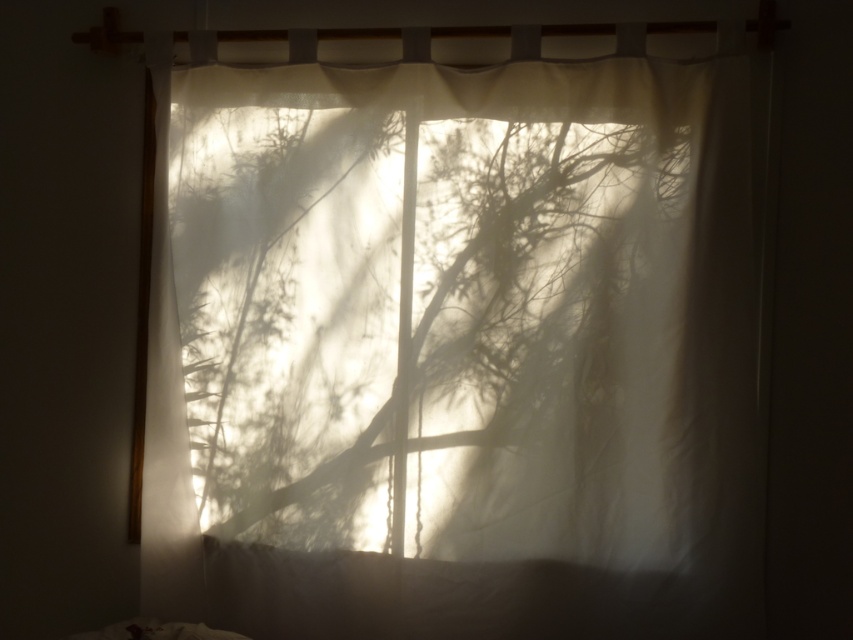
Question: Is translucent white curtain at center to the left of white soft pillow at lower center from the viewer's perspective?

Choices:
 (A) yes
 (B) no

Answer: (A)

Question: Does translucent white curtain at center appear over white soft pillow at lower center?

Choices:
 (A) yes
 (B) no

Answer: (A)

Question: Does translucent white curtain at center appear over white soft pillow at lower center?

Choices:
 (A) yes
 (B) no

Answer: (A)

Question: Which of the following is the closest to the observer?

Choices:
 (A) (485, 486)
 (B) (436, 593)

Answer: (A)